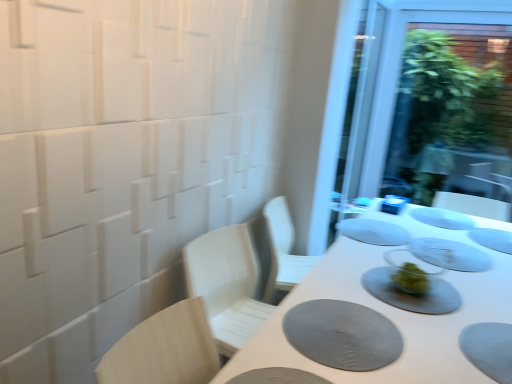
The image size is (512, 384). Identify the location of vacant area that is situated to the right of gray textured placemat at lower right. (435, 336).